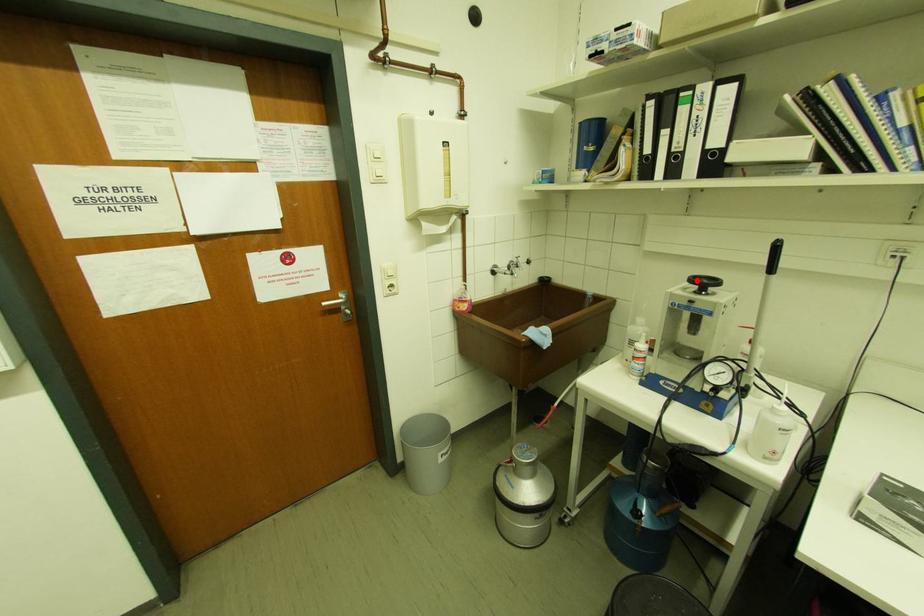
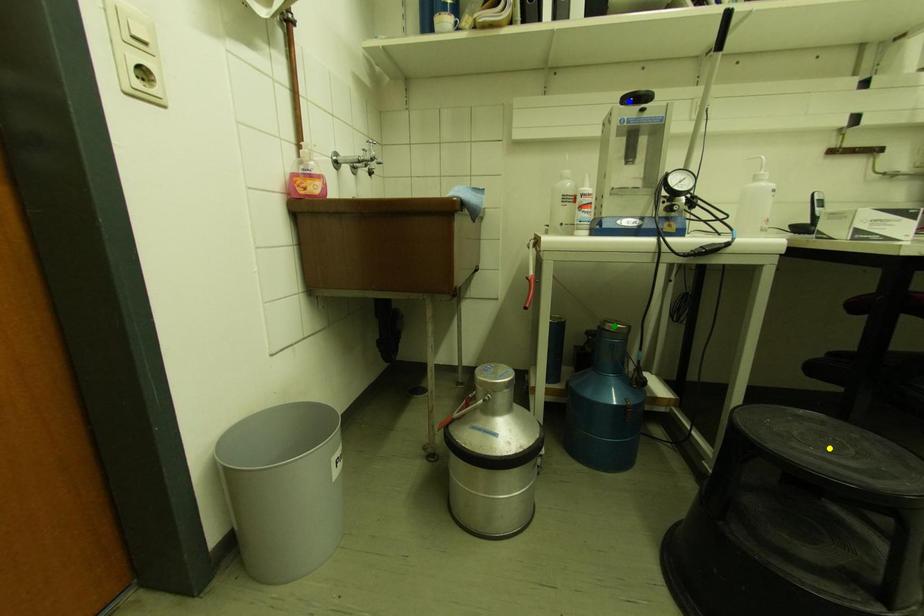
Question: I am providing you with two images of the same scene from different viewpoints. A red point is marked on the first image. You are given multiple points on the second image. Which mark in image 2 goes with the point in image 1?

Choices:
 (A) green point
 (B) blue point
 (C) yellow point

Answer: (B)